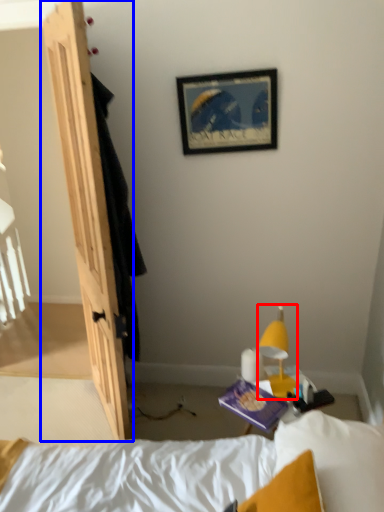
Question: Which object is further to the camera taking this photo, light fixture (highlighted by a red box) or door (highlighted by a blue box)?

Choices:
 (A) light fixture
 (B) door

Answer: (B)